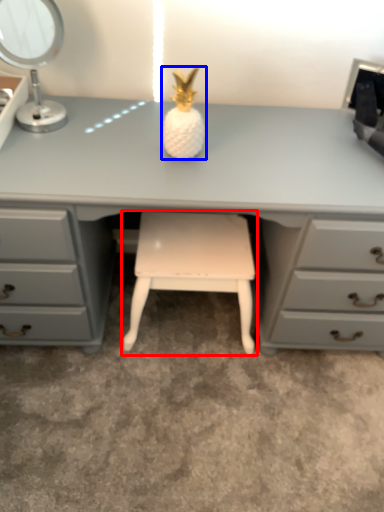
Question: Which object appears farthest to the camera in this image, stool (highlighted by a red box) or miniature (highlighted by a blue box)?

Choices:
 (A) stool
 (B) miniature

Answer: (A)